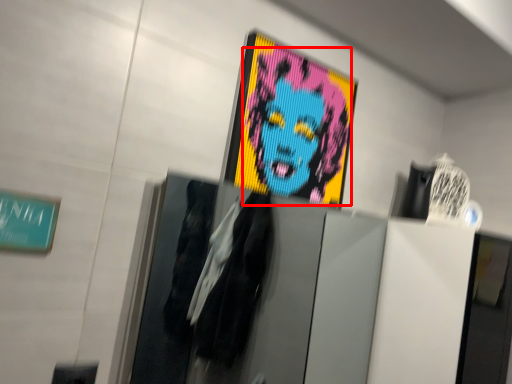
Question: From the image's perspective, where is person (annotated by the red box) located in relation to poster in the image?

Choices:
 (A) below
 (B) above

Answer: (B)